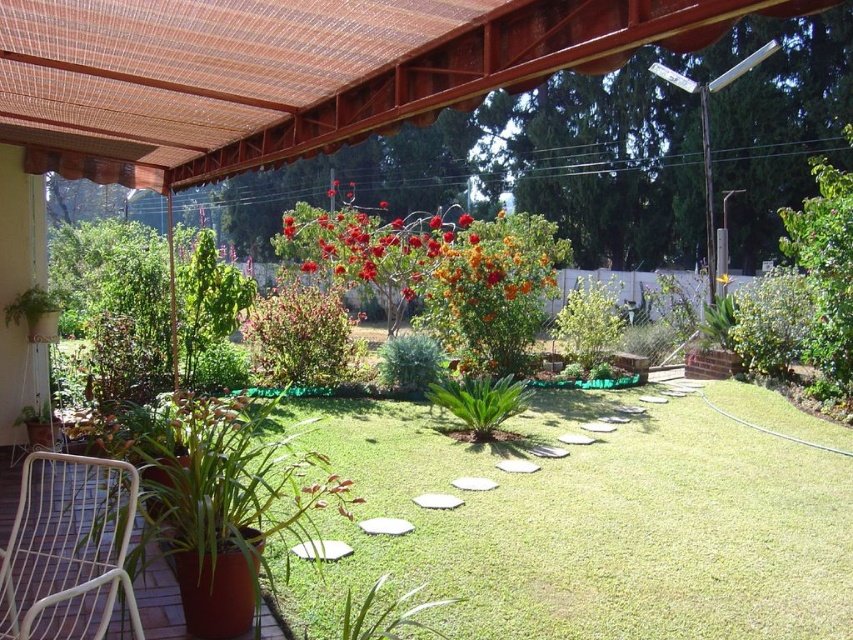
You are planning to place a new decorative item on the patio. You have a small statue that needs to be placed between the white wicker chair at lower left and the yellow matte flower at center. Is there enough space between them to place the statue?

The white wicker chair at lower left is to the left of the yellow matte flower at center, so there is space between them to place the statue.

You are a gardener standing next to the white wicker chair at lower left and need to reach the vibrant orange petals at center to collect them. Considering the distance between them, can you estimate whether you can comfortably walk to the petals without needing to take more than 10 steps?

The white wicker chair at lower left and vibrant orange petals at center are 9.88 meters apart. Assuming an average step length of about 0.75 meters, this distance would require approximately 13 steps. Therefore, you would need to take more than 10 steps to reach the vibrant orange petals at center from the white wicker chair at lower left.